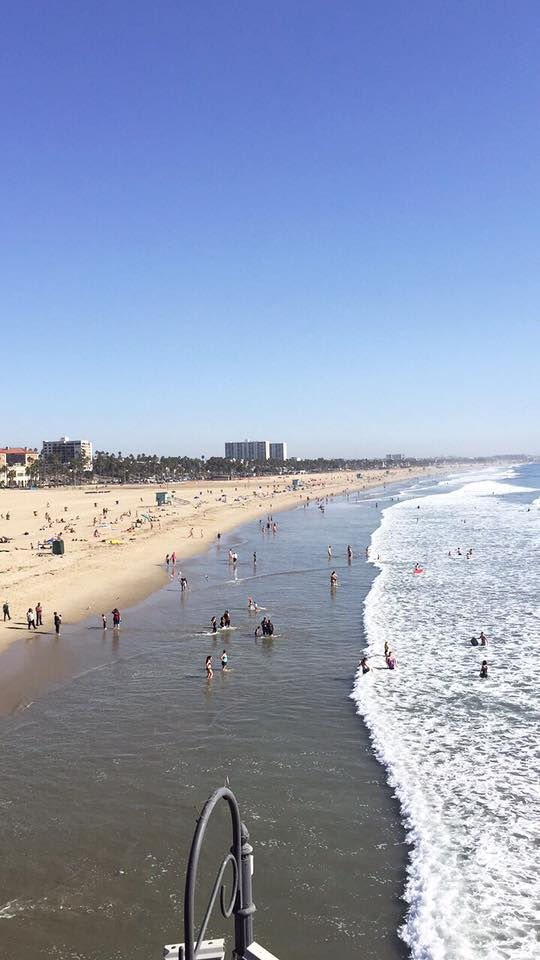
This screenshot has width=540, height=960. Identify the location of foam. (459, 797).